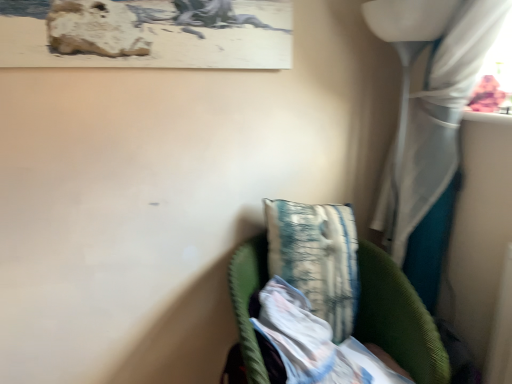
What do you see at coordinates (429, 101) in the screenshot?
I see `white sheer curtain at right` at bounding box center [429, 101].

The width and height of the screenshot is (512, 384). Find the location of `textured fabric pillow at center`. textured fabric pillow at center is located at coordinates [x=317, y=257].

The width and height of the screenshot is (512, 384). Identify the location of white sheer curtain at right. (429, 101).

Between point (309, 281) and point (407, 136), which one is positioned behind?

The point (407, 136) is farther.

Does green corduroy chair at lower right come behind white sheer curtain at right?

That is True.

Considering the sizes of objects green corduroy chair at lower right and white sheer curtain at right in the image provided, who is shorter, green corduroy chair at lower right or white sheer curtain at right?

green corduroy chair at lower right.

Is green corduroy chair at lower right not within white sheer curtain at right?

Yes, green corduroy chair at lower right is located beyond the bounds of white sheer curtain at right.

Which is in front, point (305, 233) or point (404, 37)?

The point (404, 37) is closer to the camera.

Is textured fabric pillow at center bigger than white sheer curtain at right?

No.

Which object is thinner, textured fabric pillow at center or white sheer curtain at right?

white sheer curtain at right.

Is textured fabric pillow at center positioned beyond the bounds of green corduroy chair at lower right?

No, textured fabric pillow at center is inside or overlapping with green corduroy chair at lower right.

What are the coordinates of `furniture below the textured fabric pillow at center (from a real-world perspective)` in the screenshot? It's located at (322, 319).

How many degrees apart are the facing directions of textured fabric pillow at center and green corduroy chair at lower right?

The angular difference between textured fabric pillow at center and green corduroy chair at lower right is 4.88 degrees.

Between textured fabric pillow at center and green corduroy chair at lower right, which one appears on the right side from the viewer's perspective?

green corduroy chair at lower right.

Is white sheer curtain at right far from white textured fabric at lower center?

That's not correct — white sheer curtain at right is a little close to white textured fabric at lower center.

Does point (449, 56) come farther from viewer compared to point (337, 365)?

Yes, point (449, 56) is behind point (337, 365).

Who is shorter, white sheer curtain at right or white textured fabric at lower center?

With less height is white textured fabric at lower center.

From the image's perspective, between white sheer curtain at right and white textured fabric at lower center, which one is located above?

white sheer curtain at right is shown above in the image.

Which object is positioned more to the left, white textured fabric at lower center or green corduroy chair at lower right?

From the viewer's perspective, green corduroy chair at lower right appears more on the left side.

From the picture: Considering their positions, is white textured fabric at lower center located in front of or behind green corduroy chair at lower right?

white textured fabric at lower center is behind green corduroy chair at lower right.

Is white textured fabric at lower center inside or outside of green corduroy chair at lower right?

white textured fabric at lower center is located inside green corduroy chair at lower right.

Locate an element on the screen. This screenshot has height=384, width=512. wrapping paper lying behind the green corduroy chair at lower right is located at coordinates (314, 343).

Considering the sizes of white textured fabric at lower center and white sheer curtain at right in the image, is white textured fabric at lower center bigger or smaller than white sheer curtain at right?

Clearly, white textured fabric at lower center is smaller in size than white sheer curtain at right.

Consider the image. Is white sheer curtain at right at the back of white textured fabric at lower center?

No, white textured fabric at lower center is not facing the opposite direction of white sheer curtain at right.

From a real-world perspective, is white textured fabric at lower center below white sheer curtain at right?

Yes.

Find the location of a particular element. This screenshot has width=512, height=384. wrapping paper below the white sheer curtain at right (from a real-world perspective) is located at coordinates (314, 343).

From a real-world perspective, is white sheer curtain at right physically above green corduroy chair at lower right?

Indeed, from a real-world perspective, white sheer curtain at right stands above green corduroy chair at lower right.

Locate an element on the screen. This screenshot has width=512, height=384. curtain on the right of green corduroy chair at lower right is located at coordinates (429, 101).

Is white sheer curtain at right not near green corduroy chair at lower right?

No, white sheer curtain at right is not far from green corduroy chair at lower right.

Between white sheer curtain at right and green corduroy chair at lower right, which one appears on the right side from the viewer's perspective?

white sheer curtain at right.

The height and width of the screenshot is (384, 512). In order to click on curtain above the green corduroy chair at lower right (from the image's perspective) in this screenshot , I will do point(429,101).

Find the location of a particular element. This screenshot has width=512, height=384. pillow located underneath the white sheer curtain at right (from a real-world perspective) is located at coordinates (317, 257).

From the picture: Considering their positions, is textured fabric pillow at center positioned closer to white textured fabric at lower center than green corduroy chair at lower right?

Among the two, green corduroy chair at lower right is located nearer to white textured fabric at lower center.

When comparing their distances from textured fabric pillow at center, does white textured fabric at lower center or white sheer curtain at right seem further?

Among the two, white sheer curtain at right is located further to textured fabric pillow at center.

Based on their spatial positions, is white sheer curtain at right or textured fabric pillow at center further from green corduroy chair at lower right?

Based on the image, white sheer curtain at right appears to be further to green corduroy chair at lower right.

From the image, which object appears to be farther from textured fabric pillow at center, white textured fabric at lower center or green corduroy chair at lower right?

white textured fabric at lower center is further to textured fabric pillow at center.

Based on the photo, looking at the image, which one is located further to white sheer curtain at right, green corduroy chair at lower right or textured fabric pillow at center?

green corduroy chair at lower right.

When comparing their distances from green corduroy chair at lower right, does textured fabric pillow at center or white sheer curtain at right seem closer?

The object closer to green corduroy chair at lower right is textured fabric pillow at center.

Based on their spatial positions, is white sheer curtain at right or green corduroy chair at lower right closer to white textured fabric at lower center?

Among the two, green corduroy chair at lower right is located nearer to white textured fabric at lower center.

When comparing their distances from green corduroy chair at lower right, does white textured fabric at lower center or white sheer curtain at right seem further?

white sheer curtain at right is further to green corduroy chair at lower right.

Where is `wrapping paper between white sheer curtain at right and green corduroy chair at lower right in the up-down direction`? wrapping paper between white sheer curtain at right and green corduroy chair at lower right in the up-down direction is located at coordinates (314, 343).

Find the location of a particular element. wrapping paper located between green corduroy chair at lower right and textured fabric pillow at center in the depth direction is located at coordinates pos(314,343).

The image size is (512, 384). I want to click on pillow between white sheer curtain at right and white textured fabric at lower center in the up-down direction, so click(x=317, y=257).

The height and width of the screenshot is (384, 512). Find the location of `pillow that lies between white sheer curtain at right and green corduroy chair at lower right from top to bottom`. pillow that lies between white sheer curtain at right and green corduroy chair at lower right from top to bottom is located at coordinates (317, 257).